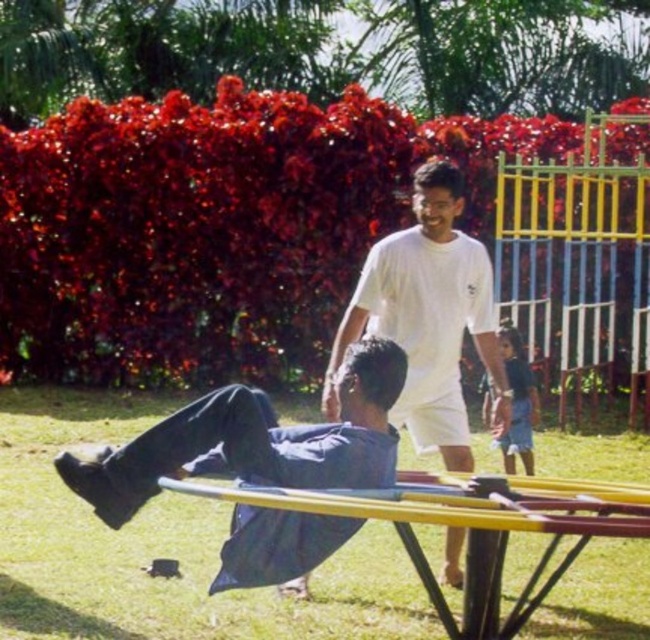
Based on the photo, can you confirm if dark blue fabric at center is taller than yellow metallic picnic table at lower center?

Correct, dark blue fabric at center is much taller as yellow metallic picnic table at lower center.

Is dark blue fabric at center below yellow metallic picnic table at lower center?

No, dark blue fabric at center is not below yellow metallic picnic table at lower center.

The width and height of the screenshot is (650, 640). In order to click on dark blue fabric at center in this screenshot , I will do `click(254, 442)`.

Locate an element on the screen. This screenshot has height=640, width=650. dark blue fabric at center is located at coordinates (254, 442).

From the picture: Which is more to the left, yellow metallic picnic table at lower center or blue denim shorts at center?

yellow metallic picnic table at lower center is more to the left.

Between yellow metallic picnic table at lower center and blue denim shorts at center, which one has more height?

blue denim shorts at center

Locate an element on the screen. The height and width of the screenshot is (640, 650). yellow metallic picnic table at lower center is located at coordinates (473, 529).

Describe the element at coordinates (429, 317) in the screenshot. I see `white cotton t-shirt at center` at that location.

Does white cotton t-shirt at center appear over blue denim shorts at center?

Yes.

The height and width of the screenshot is (640, 650). Describe the element at coordinates (429, 317) in the screenshot. I see `white cotton t-shirt at center` at that location.

The width and height of the screenshot is (650, 640). In order to click on white cotton t-shirt at center in this screenshot , I will do `click(429, 317)`.